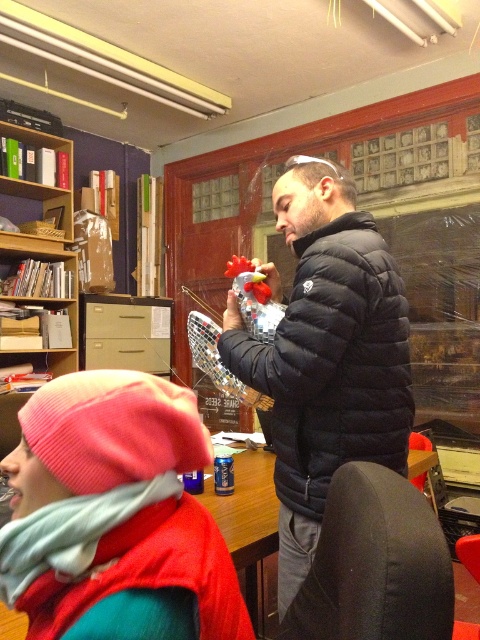
Looking at this image, you are an interior designer assessing the layout of the room. Given the coordinates provided, where exactly is the black puffy jacket at center located in the room?

The black puffy jacket at center is located at coordinates point (334, 362).

You are standing in the studio and want to move from the point at coordinates (216, 531) to the point at coordinates (349, 429). Based on the image, will you need to walk towards the wall or away from it?

Point (216, 531) is in front of point (349, 429), so you would need to walk away from the wall to reach the latter point.

You are standing in the studio and need to reach both points marked in the image. Which point, point [243,362] or point [259,624], is closer to you?

Point [243,362] is closer to the viewer than point [259,624].